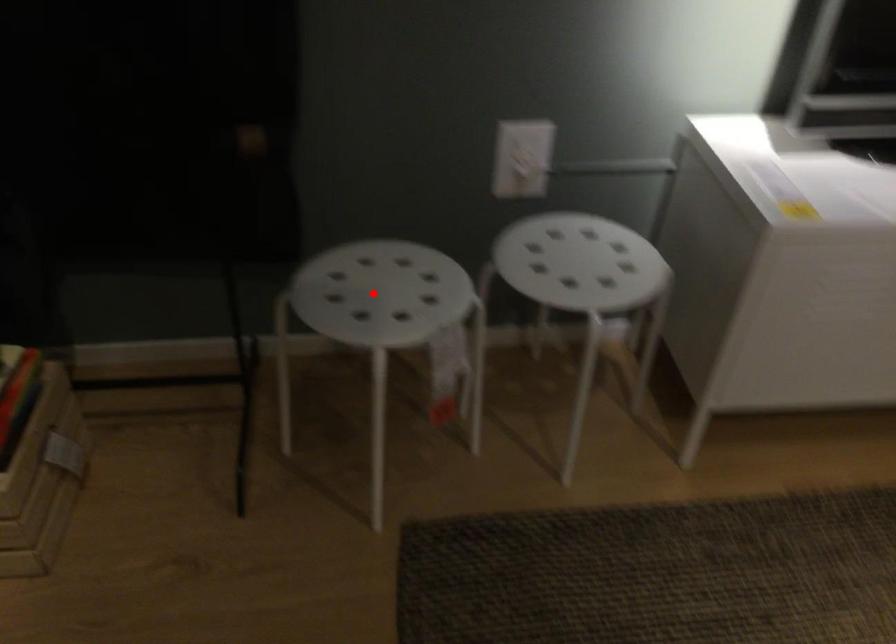
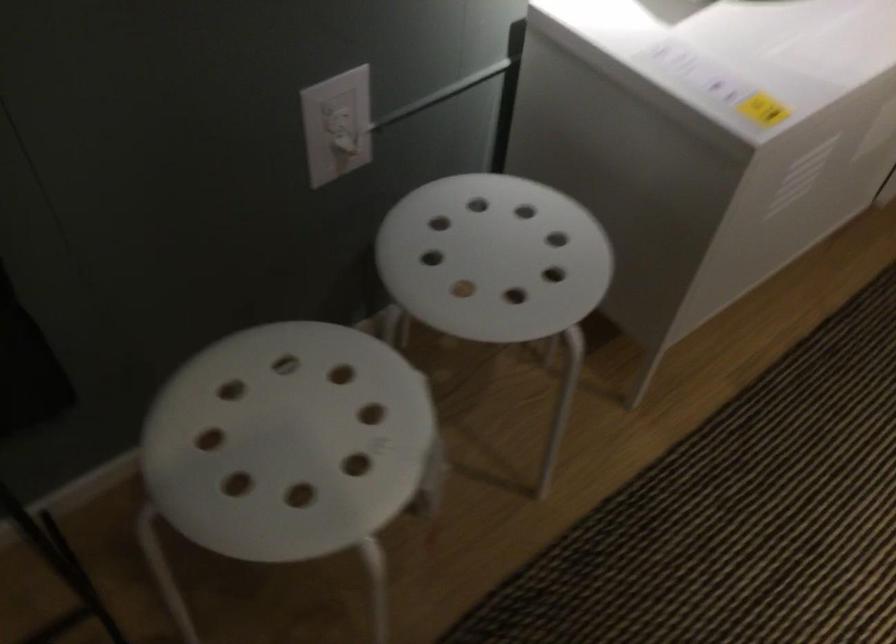
Question: I am providing you with two images of the same scene from different viewpoints. A red point is marked on the first image. At the location where the point appears in image 1, is it still visible in image 2?

Choices:
 (A) Yes
 (B) No

Answer: (A)